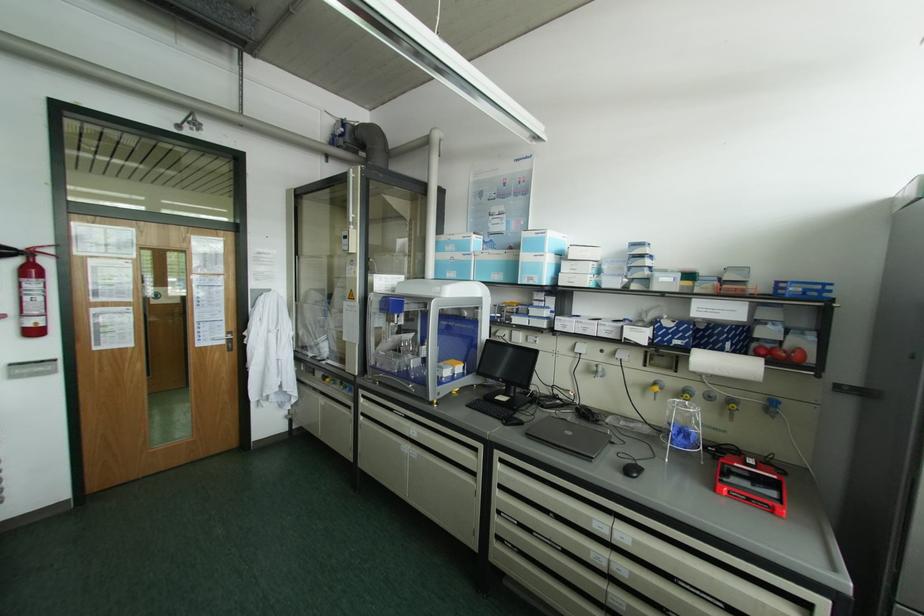
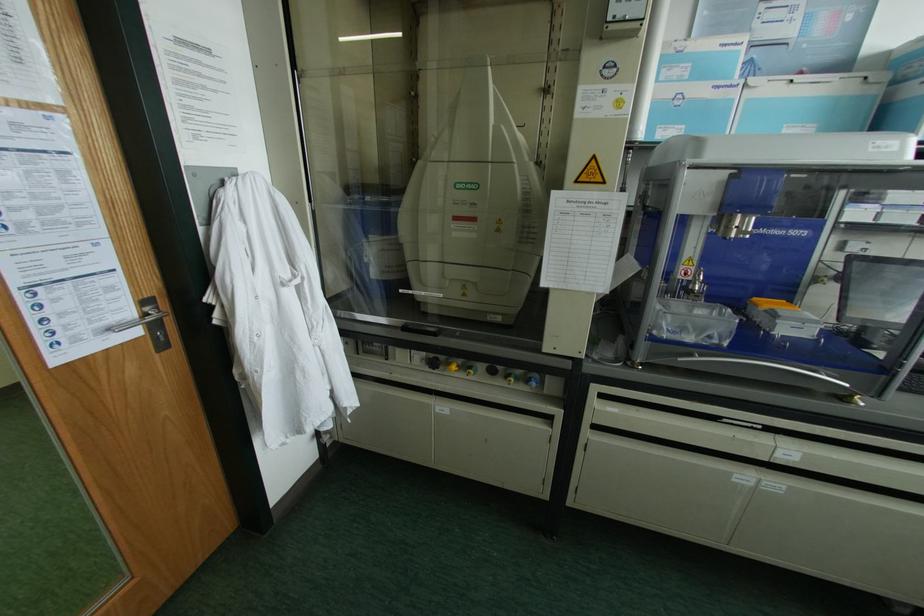
Where in the second image is the point corresponding to the point at 323,378 from the first image?

(432, 363)